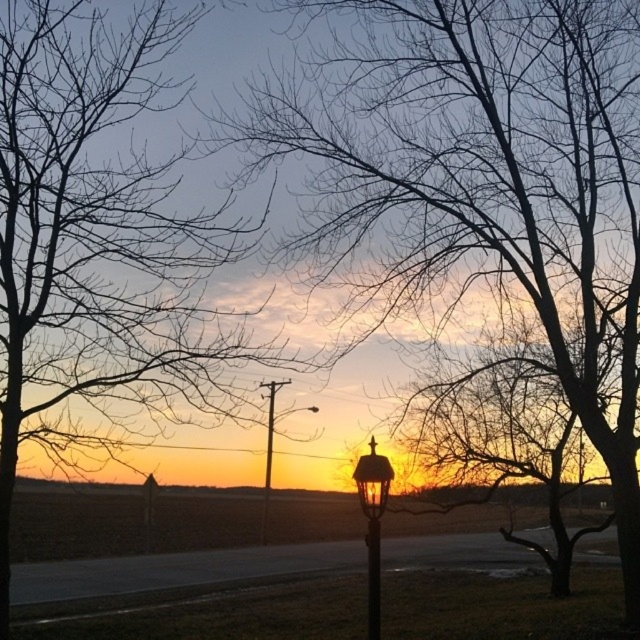
Question: Can you confirm if silhouette bare tree at left is positioned to the left of metallic streetlight at center?

Choices:
 (A) yes
 (B) no

Answer: (A)

Question: Which point is closer to the camera?

Choices:
 (A) metallic streetlamp at center
 (B) silhouette bare tree at center
 (C) metallic streetlight at center
 (D) silhouette bare tree at left

Answer: (A)

Question: Is silhouette bare tree at center above matte black lamp post at center?

Choices:
 (A) yes
 (B) no

Answer: (A)

Question: Can you confirm if silhouette bare tree at left is wider than metallic streetlamp at center?

Choices:
 (A) no
 (B) yes

Answer: (B)

Question: Which of the following is the farthest from the observer?

Choices:
 (A) matte black lamp post at center
 (B) silhouette bare tree at center
 (C) metallic streetlamp at center

Answer: (B)

Question: Which of the following is the closest to the observer?

Choices:
 (A) (337, 260)
 (B) (376, 464)
 (C) (90, 42)

Answer: (B)